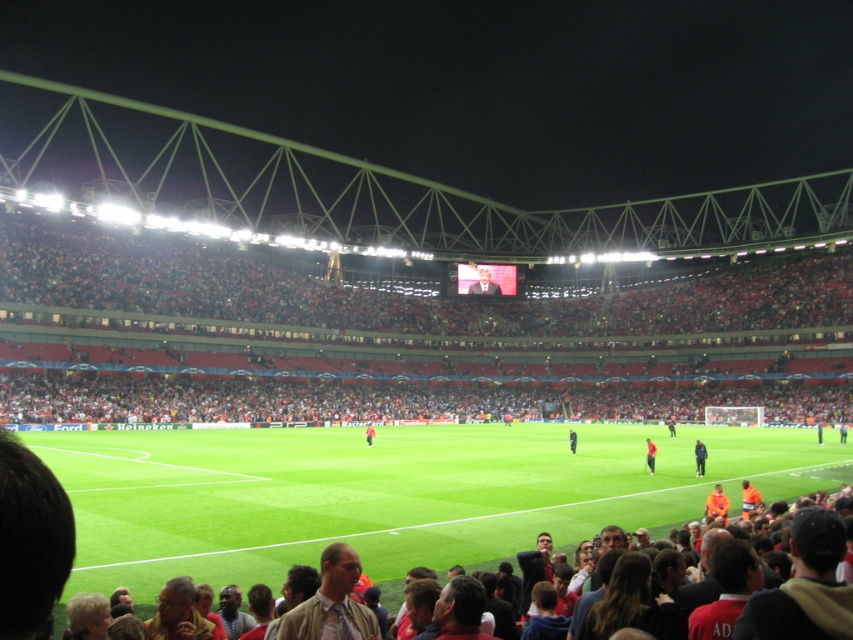
Question: Is green grass football field at lower center to the right of dark blue jacket at lower right from the viewer's perspective?

Choices:
 (A) no
 (B) yes

Answer: (A)

Question: Among these points, which one is nearest to the camera?

Choices:
 (A) (651, 468)
 (B) (136, 492)
 (C) (572, 449)
 (D) (699, 476)

Answer: (B)

Question: Which point is closer to the camera?

Choices:
 (A) dark blue jacket at lower right
 (B) orange jersey at center

Answer: (A)

Question: Among these points, which one is farthest from the camera?

Choices:
 (A) (698, 474)
 (B) (492, 285)
 (C) (370, 435)

Answer: (B)

Question: Does green grass football field at lower center have a larger size compared to dark blue jacket at lower right?

Choices:
 (A) no
 (B) yes

Answer: (B)

Question: Considering the relative positions of green grass football field at lower center and orange jersey at center in the image provided, where is green grass football field at lower center located with respect to orange jersey at center?

Choices:
 (A) right
 (B) left

Answer: (A)